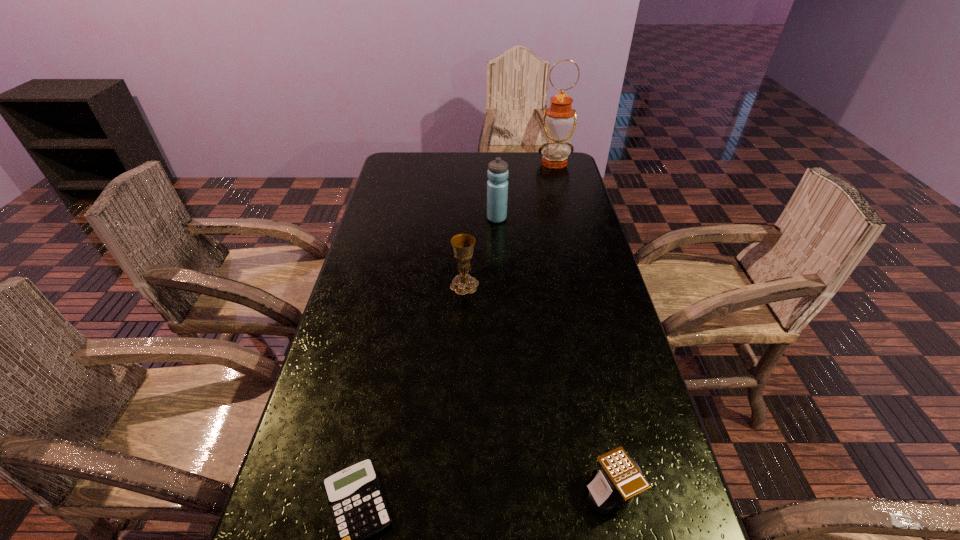
The width and height of the screenshot is (960, 540). In order to click on the tallest object in this screenshot , I will do click(559, 120).

You are a GUI agent. You are given a task and a screenshot of the screen. Output one action in this format:
    pyautogui.click(x=<x>, y=<y>)
    Task: Click on the farthest object
    The width and height of the screenshot is (960, 540).
    Given the screenshot: What is the action you would take?
    pyautogui.click(x=559, y=120)

Where is `water bottle`? This screenshot has width=960, height=540. water bottle is located at coordinates (497, 186).

Find the location of a particular element. The width and height of the screenshot is (960, 540). the fourth shortest object is located at coordinates (497, 186).

Identify the location of the second object from left to right. The height and width of the screenshot is (540, 960). (463, 244).

I want to click on chalice, so click(463, 244).

Find the location of a particular element. The height and width of the screenshot is (540, 960). the taller calculator is located at coordinates (620, 478).

The width and height of the screenshot is (960, 540). In order to click on the fourth tallest object in this screenshot , I will do `click(620, 478)`.

This screenshot has width=960, height=540. Find the location of `free space located on the front of the farthest object`. free space located on the front of the farthest object is located at coordinates (569, 220).

The image size is (960, 540). Identify the location of vacant space located 0.270m on the back of the second tallest object. (494, 175).